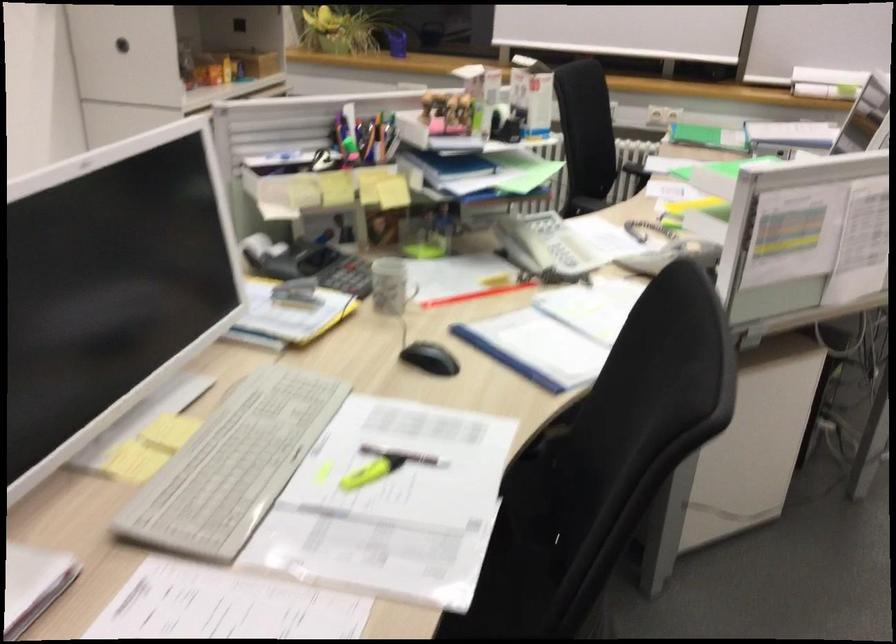
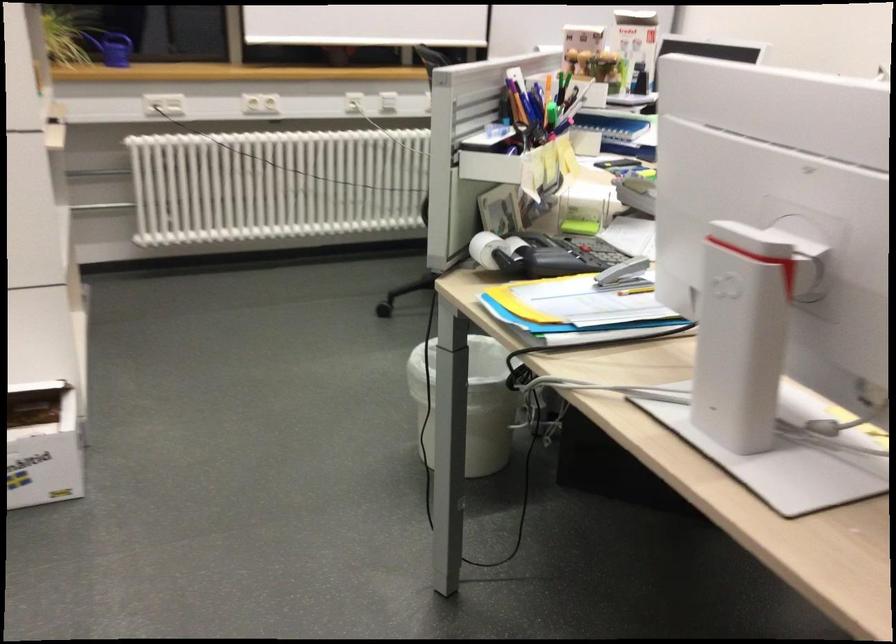
Question: I am providing you with two images of the same scene from different viewpoints. Please identify which objects are invisible in image2.

Choices:
 (A) grey stapler
 (B) red pencil
 (C) metal utensil holder
 (D) yellow paper folder

Answer: (B)